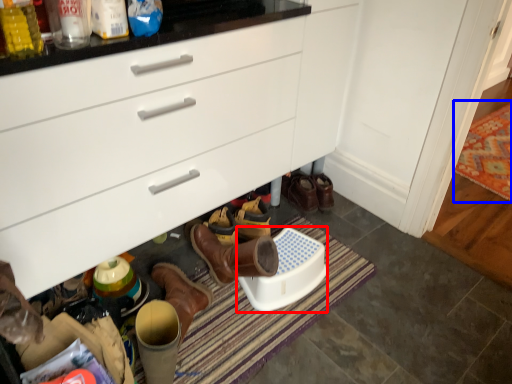
Question: Among these objects, which one is farthest to the camera, corded phone (highlighted by a red box) or mat (highlighted by a blue box)?

Choices:
 (A) corded phone
 (B) mat

Answer: (B)